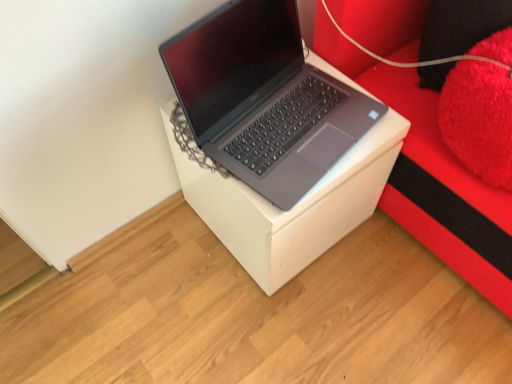
Question: From their relative heights in the image, would you say red plush cushion at right is taller or shorter than sleek silver laptop at center?

Choices:
 (A) short
 (B) tall

Answer: (B)

Question: From the image's perspective, is red plush cushion at right located above or below sleek silver laptop at center?

Choices:
 (A) above
 (B) below

Answer: (A)

Question: Which object is positioned farthest from the sleek silver laptop at center?

Choices:
 (A) red plush cushion at right
 (B) black fuzzy pillow at upper right, which is counted as the first pillow, starting from the top
 (C) fluffy red pillow at upper right, the second pillow when ordered from top to bottom
 (D) white cardboard box at center

Answer: (B)

Question: Considering the real-world distances, which object is farthest from the sleek silver laptop at center?

Choices:
 (A) red plush cushion at right
 (B) black fuzzy pillow at upper right, which appears as the 2th pillow when ordered from the bottom
 (C) fluffy red pillow at upper right, which is the 1th pillow in bottom-to-top order
 (D) white cardboard box at center

Answer: (B)